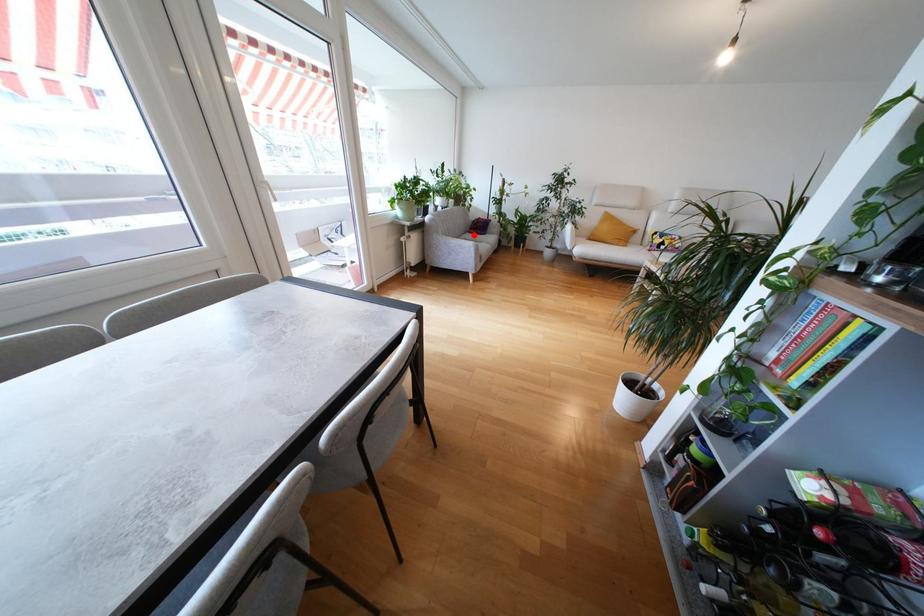
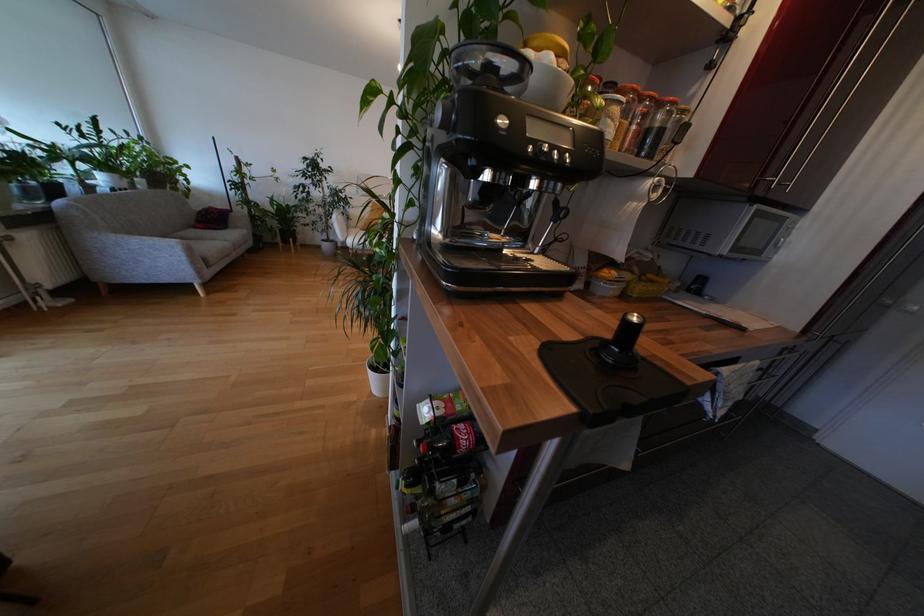
Where in the second image is the point corresponding to the highlighted location from the first image?

(200, 230)